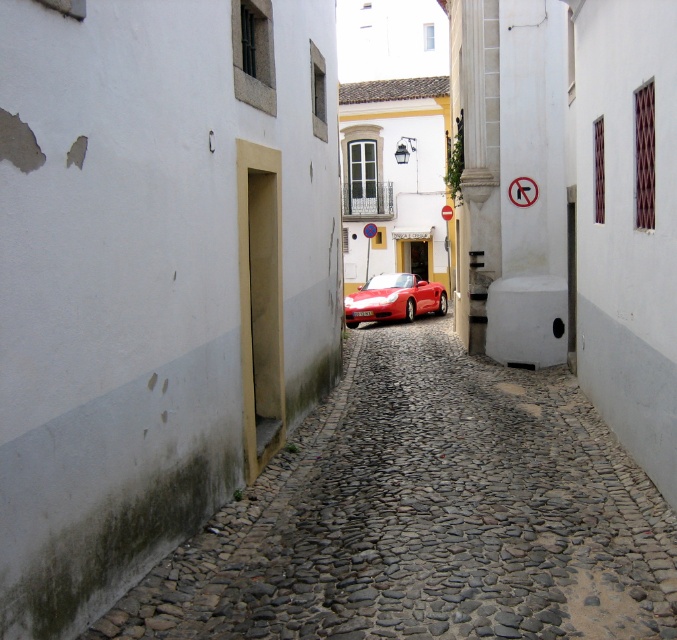
Question: Can you confirm if smooth cobblestone alley at center is smaller than metallic circular sign at center?

Choices:
 (A) no
 (B) yes

Answer: (A)

Question: Where is shiny red convertible at center located in relation to metallic circular sign at center in the image?

Choices:
 (A) left
 (B) right

Answer: (A)

Question: Estimate the real-world distances between objects in this image. Which object is closer to the smooth cobblestone alley at center?

Choices:
 (A) shiny red convertible at center
 (B) metallic circular sign at center

Answer: (A)

Question: Is shiny red convertible at center thinner than metallic circular sign at center?

Choices:
 (A) no
 (B) yes

Answer: (B)

Question: Which point appears farthest from the camera in this image?

Choices:
 (A) (634, 536)
 (B) (370, 237)

Answer: (B)

Question: Among these points, which one is nearest to the camera?

Choices:
 (A) (368, 275)
 (B) (567, 486)
 (C) (366, 292)

Answer: (B)